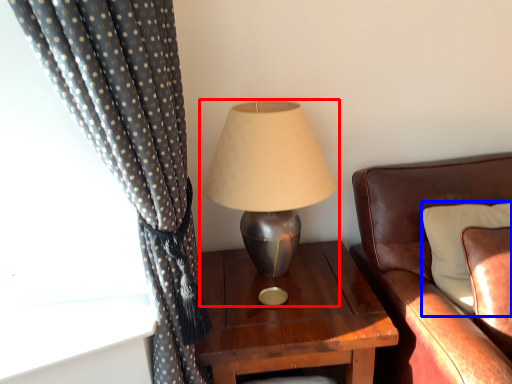
Question: Which of the following is the closest to the observer, lamp (highlighted by a red box) or pillow (highlighted by a blue box)?

Choices:
 (A) lamp
 (B) pillow

Answer: (B)